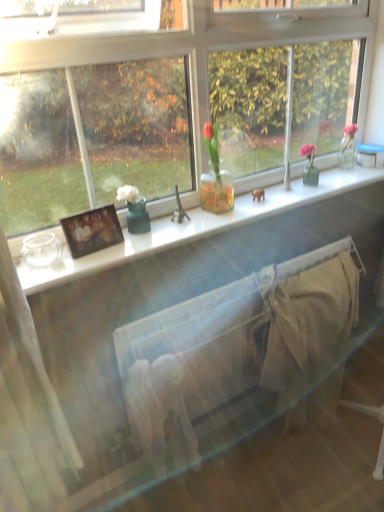
This screenshot has width=384, height=512. Find the location of `vacant area in front of beige cotton blanket at lower right`. vacant area in front of beige cotton blanket at lower right is located at coordinates (310, 479).